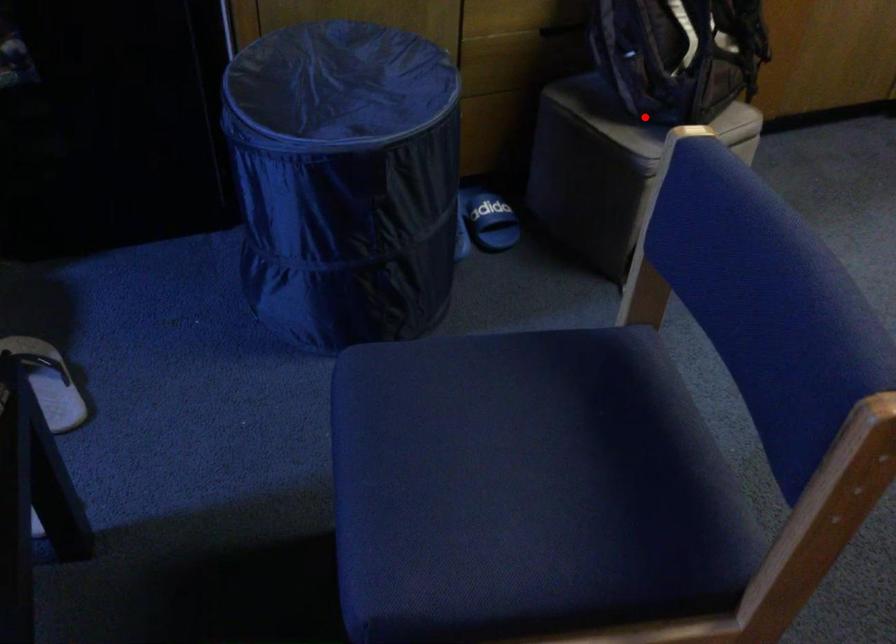
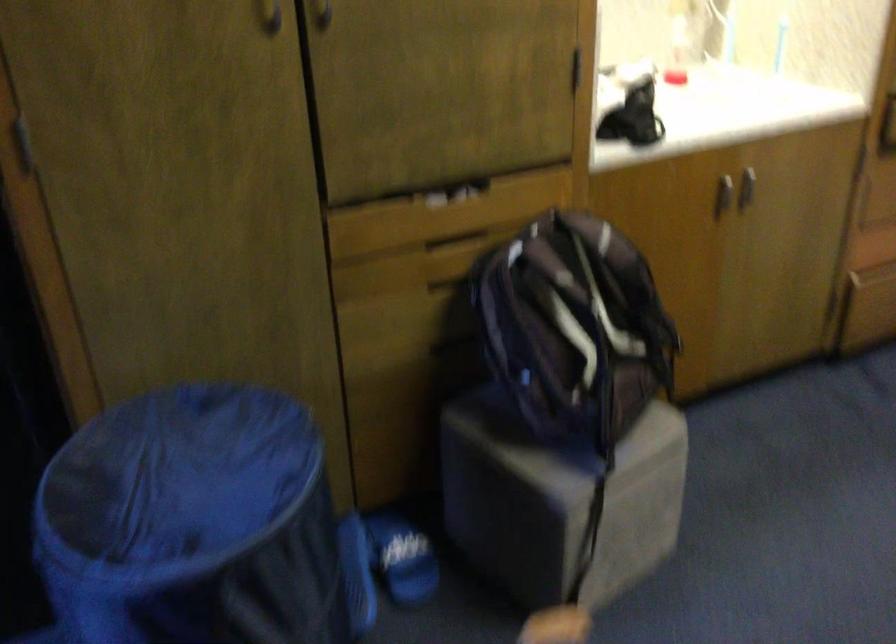
Question: I am providing you with two images of the same scene from different viewpoints. Given a red point in image1, look at the same physical point in image2. Is it:

Choices:
 (A) Closer to the viewpoint
 (B) Farther from the viewpoint

Answer: (A)